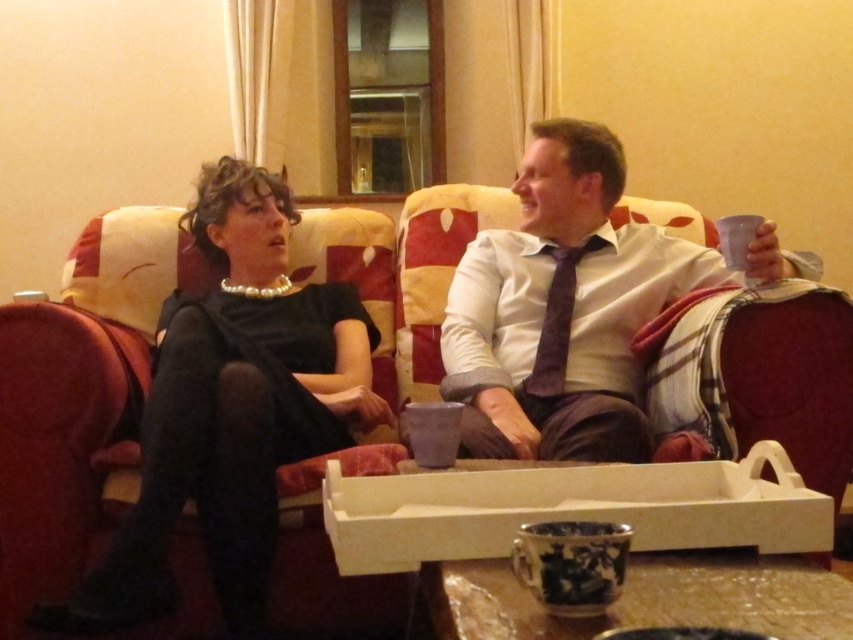
You are standing in the living room and want to take a photo of the point at coordinates (345,464). The camera has a focal length of 50mm and a sensor size of 24mm. What is the minimum distance you need to stand from the point to ensure it fits entirely within the frame?

The point at coordinates (345,464) is 1.55 meters from the camera. To ensure it fits within the frame, you should position yourself at least 1.55 meters away from the point.

You are a fashion designer observing the two individuals in the living room. You need to determine which clothing item has a narrower width between the black satin dress at center and the matte white shirt at center. Which one is narrower?

The black satin dress at center has a narrower width than the matte white shirt at center according to the description.

You are a photographer trying to capture a candid shot of both the black satin dress at center and the matte white shirt at center. Since you want to ensure both are in focus, you need to know their relative positions. Which one is nearer to you?

The black satin dress at center is closer to the viewer than the matte white shirt at center, so you should focus on the black satin dress at center first as it is nearer.